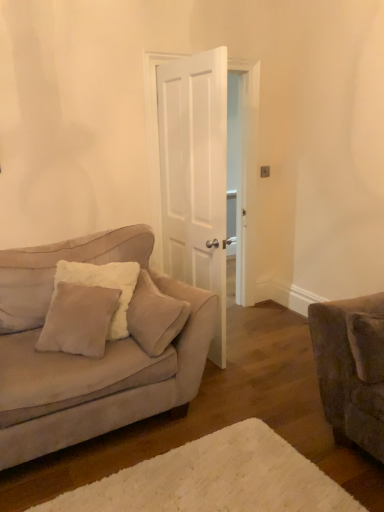
Question: From the image's perspective, is beige plush pillow at left, which is the 2th pillow from left to right, located above white fluffy rug at lower center?

Choices:
 (A) yes
 (B) no

Answer: (A)

Question: Is beige plush pillow at left, which is the 2th pillow from left to right, in front of white fluffy rug at lower center?

Choices:
 (A) no
 (B) yes

Answer: (A)

Question: From a real-world perspective, is beige plush pillow at left, which is the 2th pillow from left to right, physically below white fluffy rug at lower center?

Choices:
 (A) no
 (B) yes

Answer: (A)

Question: Is white fluffy rug at lower center at the back of beige plush pillow at left, which is the 2th pillow from left to right?

Choices:
 (A) no
 (B) yes

Answer: (A)

Question: Can you confirm if beige plush pillow at left, which is the 2th pillow from left to right, is thinner than white fluffy rug at lower center?

Choices:
 (A) no
 (B) yes

Answer: (B)

Question: Does beige plush pillow at left, which is the 2th pillow from left to right, have a greater width compared to white fluffy rug at lower center?

Choices:
 (A) yes
 (B) no

Answer: (B)

Question: Is suede-like beige pillow at lower right, the 3th pillow viewed from the left, positioned with its back to suede couch at left?

Choices:
 (A) no
 (B) yes

Answer: (A)

Question: Considering the relative sizes of suede-like beige pillow at lower right, the 3th pillow viewed from the left, and suede couch at left in the image provided, is suede-like beige pillow at lower right, the 3th pillow viewed from the left, wider than suede couch at left?

Choices:
 (A) yes
 (B) no

Answer: (B)

Question: Considering the relative sizes of suede-like beige pillow at lower right, which is counted as the first pillow, starting from the right, and suede couch at left in the image provided, is suede-like beige pillow at lower right, which is counted as the first pillow, starting from the right, taller than suede couch at left?

Choices:
 (A) no
 (B) yes

Answer: (A)

Question: Is the position of suede-like beige pillow at lower right, the 3th pillow viewed from the left, less distant than that of suede couch at left?

Choices:
 (A) yes
 (B) no

Answer: (B)

Question: Can we say suede-like beige pillow at lower right, the 3th pillow viewed from the left, lies outside suede couch at left?

Choices:
 (A) no
 (B) yes

Answer: (B)

Question: Can you confirm if suede-like beige pillow at lower right, the 3th pillow viewed from the left, is thinner than suede couch at left?

Choices:
 (A) no
 (B) yes

Answer: (B)

Question: Is suede couch at left far away from beige plush pillow at left, marked as the second pillow in a right-to-left arrangement?

Choices:
 (A) no
 (B) yes

Answer: (A)